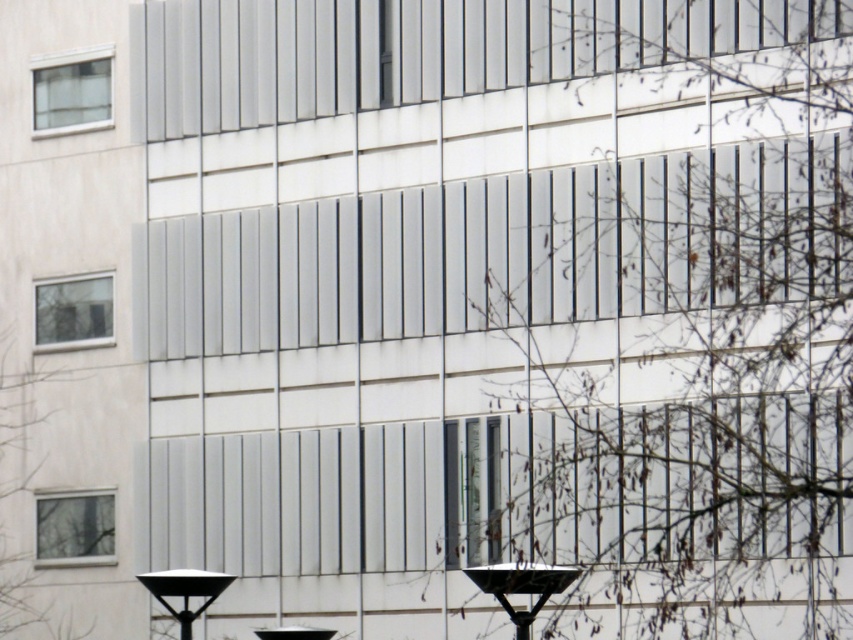
You are standing in front of the modern building facade and want to locate the clear glass window at lower left. According to the coordinates provided, where exactly should you look to find it?

The clear glass window at lower left is located at point (x=74, y=529), so you should look towards those coordinates to find it.

You are standing in front of a modern building and notice a clear glass window at left and a black plastic streetlight at lower center. Which object is positioned to the left of the other?

The clear glass window at left is to the left of the black plastic streetlight at lower center.

You are a window cleaner standing at the base of the building. You have a ladder that can reach up to 3 meters. You need to clean both the clear glass window at lower left and the clear glass window at left. Which window will require you to use the ladder?

The clear glass window at lower left is much taller than the clear glass window at left, so you will need to use the ladder to clean the clear glass window at lower left because its height exceeds the ladder reach limit.